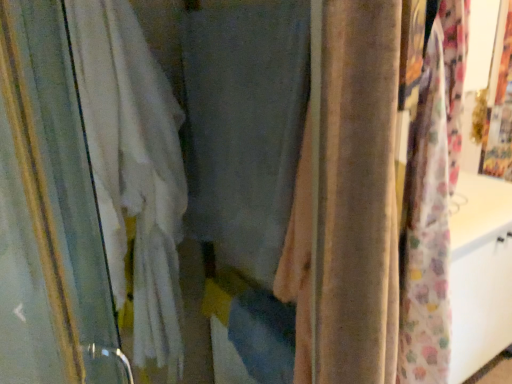
Question: Considering the positions of white fabric curtain at left, placed as the 3th curtain when sorted from right to left, and matte gray curtain at center, which is the 2th curtain in left-to-right order, in the image, is white fabric curtain at left, placed as the 3th curtain when sorted from right to left, taller or shorter than matte gray curtain at center, which is the 2th curtain in left-to-right order,?

Choices:
 (A) tall
 (B) short

Answer: (A)

Question: Is white fabric curtain at left, placed as the 3th curtain when sorted from right to left, wider or thinner than matte gray curtain at center, arranged as the 2th curtain when viewed from the right?

Choices:
 (A) thin
 (B) wide

Answer: (B)

Question: Based on their relative distances, which object is farther from the velvet beige curtain at center, the first curtain from the right?

Choices:
 (A) white fabric curtain at left, which is the 1th curtain from left to right
 (B) matte gray curtain at center, which is the 2th curtain in left-to-right order

Answer: (A)

Question: Which of these objects is positioned farthest from the white fabric curtain at left, placed as the 3th curtain when sorted from right to left?

Choices:
 (A) velvet beige curtain at center, which is the 3th curtain from left to right
 (B) matte gray curtain at center, which is the 2th curtain in left-to-right order

Answer: (A)